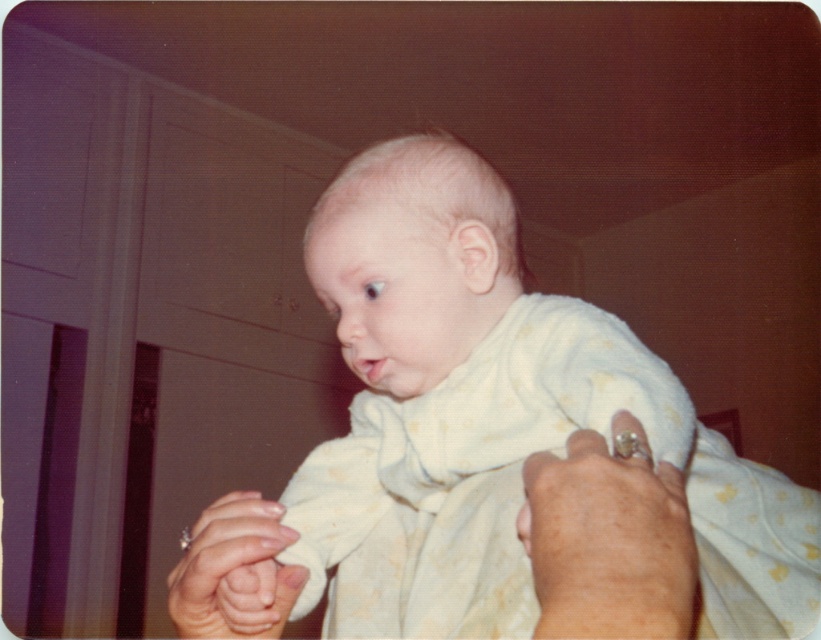
Is white soft cloth at center thinner than smooth skin hand at lower right?

In fact, white soft cloth at center might be wider than smooth skin hand at lower right.

How far apart are white soft cloth at center and smooth skin hand at lower right?

They are 6.40 inches apart.

Which is behind, point (335, 205) or point (654, 474)?

Positioned behind is point (335, 205).

Locate an element on the screen. This screenshot has width=821, height=640. white soft cloth at center is located at coordinates (487, 426).

The height and width of the screenshot is (640, 821). What do you see at coordinates (608, 540) in the screenshot?
I see `smooth skin hand at lower right` at bounding box center [608, 540].

Between point (650, 586) and point (297, 566), which one is positioned in front?

Point (650, 586)

Between point (544, 472) and point (277, 545), which one is positioned in front?

Point (544, 472) is more forward.

Find the location of `smooth skin hand at lower right`. smooth skin hand at lower right is located at coordinates (608, 540).

Is white soft cloth at center in front of smooth skin hand at lower left?

Yes, it is.

Which of these two, white soft cloth at center or smooth skin hand at lower left, stands shorter?

smooth skin hand at lower left is shorter.

Who is more forward, (377, 182) or (223, 577)?

Point (223, 577) is in front.

I want to click on white soft cloth at center, so click(x=487, y=426).